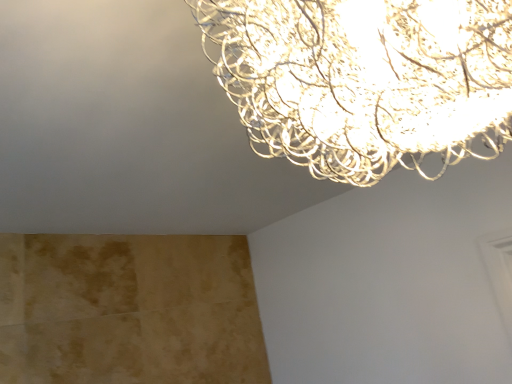
Describe the element at coordinates (364, 80) in the screenshot. I see `clear glass chandelier at upper right` at that location.

Where is `clear glass chandelier at upper right`? This screenshot has width=512, height=384. clear glass chandelier at upper right is located at coordinates (364, 80).

Locate an element on the screen. The width and height of the screenshot is (512, 384). clear glass chandelier at upper right is located at coordinates (364, 80).